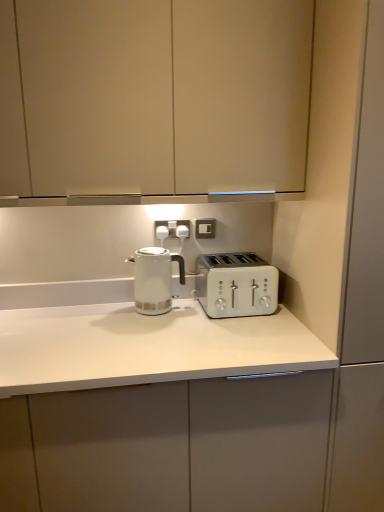
You are a GUI agent. You are given a task and a screenshot of the screen. Output one action in this format:
    pyautogui.click(x=<x>, y=<y>)
    Task: Click on the white glossy countertop at center, which is the first cabinetry in bottom-to-top order
    
    Given the screenshot: What is the action you would take?
    pyautogui.click(x=169, y=446)

Image resolution: width=384 pixels, height=512 pixels. What do you see at coordinates (172, 229) in the screenshot? I see `white plastic electrical outlet at center, which is the 1th electric outlet in left-to-right order` at bounding box center [172, 229].

This screenshot has height=512, width=384. Describe the element at coordinates (154, 96) in the screenshot. I see `matte white cabinet at upper center, which is the 1th cabinetry in top-to-bottom order` at that location.

Where is `matte white cabinet at upper center, the 2th cabinetry positioned from the bottom`? matte white cabinet at upper center, the 2th cabinetry positioned from the bottom is located at coordinates (154, 96).

The image size is (384, 512). What do you see at coordinates (205, 228) in the screenshot?
I see `white plastic electric outlet at center, which is the 1th electric outlet from right to left` at bounding box center [205, 228].

Identify the location of white glossy countertop at center, which is the first cabinetry in bottom-to-top order. (169, 446).

Which is behind, white plastic electric outlet at center, which is the 1th electric outlet from right to left, or white glossy countertop at center, which appears as the second cabinetry when viewed from the top?

Positioned behind is white plastic electric outlet at center, which is the 1th electric outlet from right to left.

From their relative heights in the image, would you say white plastic electric outlet at center, which is the 1th electric outlet from right to left, is taller or shorter than white glossy countertop at center, which appears as the second cabinetry when viewed from the top?

Clearly, white plastic electric outlet at center, which is the 1th electric outlet from right to left, is shorter compared to white glossy countertop at center, which appears as the second cabinetry when viewed from the top.

Is white plastic electric outlet at center, which is the 1th electric outlet from right to left, oriented towards white glossy countertop at center, which appears as the second cabinetry when viewed from the top?

No, white plastic electric outlet at center, which is the 1th electric outlet from right to left, is not facing towards white glossy countertop at center, which appears as the second cabinetry when viewed from the top.

Considering the sizes of objects white plastic electric outlet at center, which is the 1th electric outlet from right to left, and white glossy countertop at center, which appears as the second cabinetry when viewed from the top, in the image provided, who is bigger, white plastic electric outlet at center, which is the 1th electric outlet from right to left, or white glossy countertop at center, which appears as the second cabinetry when viewed from the top,?

white glossy countertop at center, which appears as the second cabinetry when viewed from the top.

Considering the sizes of objects white plastic electric outlet at center, positioned as the second electric outlet in left-to-right order, and white glossy kettle at center in the image provided, who is wider, white plastic electric outlet at center, positioned as the second electric outlet in left-to-right order, or white glossy kettle at center?

white glossy kettle at center.

Who is bigger, white plastic electric outlet at center, positioned as the second electric outlet in left-to-right order, or white glossy kettle at center?

Bigger between the two is white glossy kettle at center.

Does point (213, 237) come farther from viewer compared to point (155, 309)?

Yes, it is.

From the image's perspective, would you say white plastic electric outlet at center, positioned as the second electric outlet in left-to-right order, is positioned over white glossy kettle at center?

Yes.

Considering their positions, is white plastic toaster at center located in front of or behind white glossy countertop at center, which appears as the second cabinetry when viewed from the top?

Clearly, white plastic toaster at center is behind white glossy countertop at center, which appears as the second cabinetry when viewed from the top.

Is point (220, 287) farther from camera compared to point (37, 486)?

Yes, it is behind point (37, 486).

Considering the positions of objects white plastic toaster at center and white glossy countertop at center, which is the first cabinetry in bottom-to-top order, in the image provided, who is more to the right, white plastic toaster at center or white glossy countertop at center, which is the first cabinetry in bottom-to-top order,?

white plastic toaster at center is more to the right.

Considering the sizes of white plastic toaster at center and white glossy countertop at center, which appears as the second cabinetry when viewed from the top, in the image, is white plastic toaster at center wider or thinner than white glossy countertop at center, which appears as the second cabinetry when viewed from the top,?

Clearly, white plastic toaster at center has less width compared to white glossy countertop at center, which appears as the second cabinetry when viewed from the top.

Does white plastic electrical outlet at center, which is the 1th electric outlet in left-to-right order, appear on the right side of matte white cabinet at upper center, the 2th cabinetry positioned from the bottom?

Yes.

Is matte white cabinet at upper center, which is the 1th cabinetry in top-to-bottom order, at the back of white plastic electrical outlet at center, which is the 1th electric outlet in left-to-right order?

No.

Does white plastic electrical outlet at center, which is the 1th electric outlet in left-to-right order, have a lesser height compared to matte white cabinet at upper center, the 2th cabinetry positioned from the bottom?

Yes.

From the image's perspective, between white plastic toaster at center and white plastic electrical outlet at center, acting as the 2th electric outlet starting from the right, who is located below?

white plastic toaster at center appears lower in the image.

Considering the relative positions of white plastic toaster at center and white plastic electrical outlet at center, which is the 1th electric outlet in left-to-right order, in the image provided, is white plastic toaster at center to the right of white plastic electrical outlet at center, which is the 1th electric outlet in left-to-right order, from the viewer's perspective?

Yes.

From a real-world perspective, is white plastic toaster at center physically below white plastic electrical outlet at center, acting as the 2th electric outlet starting from the right?

Yes.

Based on their sizes in the image, would you say white plastic toaster at center is bigger or smaller than white plastic electrical outlet at center, acting as the 2th electric outlet starting from the right?

white plastic toaster at center is bigger than white plastic electrical outlet at center, acting as the 2th electric outlet starting from the right.

Is white plastic toaster at center at the right side of white plastic electric outlet at center, which is the 1th electric outlet from right to left?

Indeed, white plastic toaster at center is positioned on the right side of white plastic electric outlet at center, which is the 1th electric outlet from right to left.

Could you tell me if white plastic toaster at center is facing white plastic electric outlet at center, which is the 1th electric outlet from right to left?

No, white plastic toaster at center is not aimed at white plastic electric outlet at center, which is the 1th electric outlet from right to left.

From the image's perspective, is white plastic toaster at center on white plastic electric outlet at center, positioned as the second electric outlet in left-to-right order?

No, from the image's perspective, white plastic toaster at center is not on top of white plastic electric outlet at center, positioned as the second electric outlet in left-to-right order.

Is white plastic toaster at center bigger than white plastic electric outlet at center, positioned as the second electric outlet in left-to-right order?

Yes, white plastic toaster at center is bigger than white plastic electric outlet at center, positioned as the second electric outlet in left-to-right order.

Is white glossy kettle at center to the left or to the right of white plastic toaster at center in the image?

In the image, white glossy kettle at center appears on the left side of white plastic toaster at center.

Is white glossy kettle at center touching white plastic toaster at center?

white glossy kettle at center is not next to white plastic toaster at center, and they're not touching.

From the image's perspective, is white glossy kettle at center positioned above or below white plastic toaster at center?

white glossy kettle at center is situated higher than white plastic toaster at center in the image.

The height and width of the screenshot is (512, 384). I want to click on the 2nd electric outlet above the white glossy countertop at center, which is the first cabinetry in bottom-to-top order (from the image's perspective), so click(x=205, y=228).

Locate an element on the screen. kettle below the white plastic electric outlet at center, which is the 1th electric outlet from right to left (from the image's perspective) is located at coordinates (154, 279).

Which object lies further to the anchor point white glossy kettle at center, white plastic toaster at center or white plastic electrical outlet at center, which is the 1th electric outlet in left-to-right order?

Among the two, white plastic toaster at center is located further to white glossy kettle at center.

Estimate the real-world distances between objects in this image. Which object is closer to white glossy countertop at center, which appears as the second cabinetry when viewed from the top, white glossy kettle at center or white plastic toaster at center?

white plastic toaster at center is positioned closer to the anchor white glossy countertop at center, which appears as the second cabinetry when viewed from the top.

Considering their positions, is white plastic toaster at center positioned closer to white plastic electric outlet at center, which is the 1th electric outlet from right to left, than white glossy kettle at center?

white glossy kettle at center is positioned closer to the anchor white plastic electric outlet at center, which is the 1th electric outlet from right to left.

Looking at the image, which one is located closer to white glossy kettle at center, white plastic toaster at center or matte white cabinet at upper center, the 2th cabinetry positioned from the bottom?

white plastic toaster at center.

From the image, which object appears to be farther from white plastic electric outlet at center, which is the 1th electric outlet from right to left, white plastic electrical outlet at center, which is the 1th electric outlet in left-to-right order, or white glossy kettle at center?

white glossy kettle at center.

Considering their positions, is white glossy kettle at center positioned further to white plastic electrical outlet at center, acting as the 2th electric outlet starting from the right, than white plastic electric outlet at center, which is the 1th electric outlet from right to left?

Based on the image, white glossy kettle at center appears to be further to white plastic electrical outlet at center, acting as the 2th electric outlet starting from the right.

Based on their spatial positions, is white glossy countertop at center, which is the first cabinetry in bottom-to-top order, or white glossy kettle at center further from white plastic toaster at center?

white glossy countertop at center, which is the first cabinetry in bottom-to-top order, is further to white plastic toaster at center.

Which object lies nearer to the anchor point white plastic electrical outlet at center, acting as the 2th electric outlet starting from the right, white plastic electric outlet at center, positioned as the second electric outlet in left-to-right order, or white glossy kettle at center?

The object closer to white plastic electrical outlet at center, acting as the 2th electric outlet starting from the right, is white plastic electric outlet at center, positioned as the second electric outlet in left-to-right order.

You are a GUI agent. You are given a task and a screenshot of the screen. Output one action in this format:
    pyautogui.click(x=<x>, y=<y>)
    Task: Click on the electric outlet between white plastic toaster at center and white plastic electric outlet at center, positioned as the second electric outlet in left-to-right order, from front to back
    This screenshot has width=384, height=512.
    Given the screenshot: What is the action you would take?
    click(x=172, y=229)

Identify the location of electric outlet between white plastic electric outlet at center, positioned as the second electric outlet in left-to-right order, and white glossy kettle at center from top to bottom. The width and height of the screenshot is (384, 512). (172, 229).

Locate an element on the screen. The height and width of the screenshot is (512, 384). electric outlet positioned between matte white cabinet at upper center, the 2th cabinetry positioned from the bottom, and white plastic electric outlet at center, which is the 1th electric outlet from right to left, from near to far is located at coordinates (172, 229).

Locate an element on the screen. The width and height of the screenshot is (384, 512). toaster between white glossy kettle at center and white glossy countertop at center, which appears as the second cabinetry when viewed from the top, in the up-down direction is located at coordinates (236, 285).